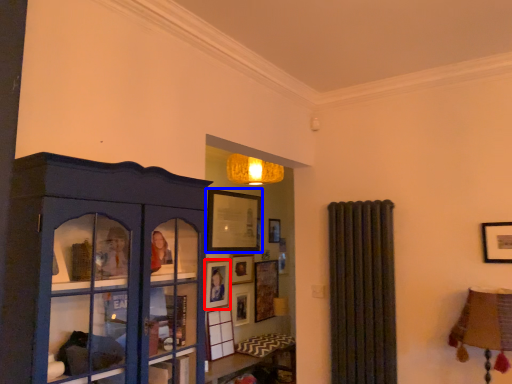
Question: Which object is further to the camera taking this photo, picture frame (highlighted by a red box) or picture frame (highlighted by a blue box)?

Choices:
 (A) picture frame
 (B) picture frame

Answer: (B)